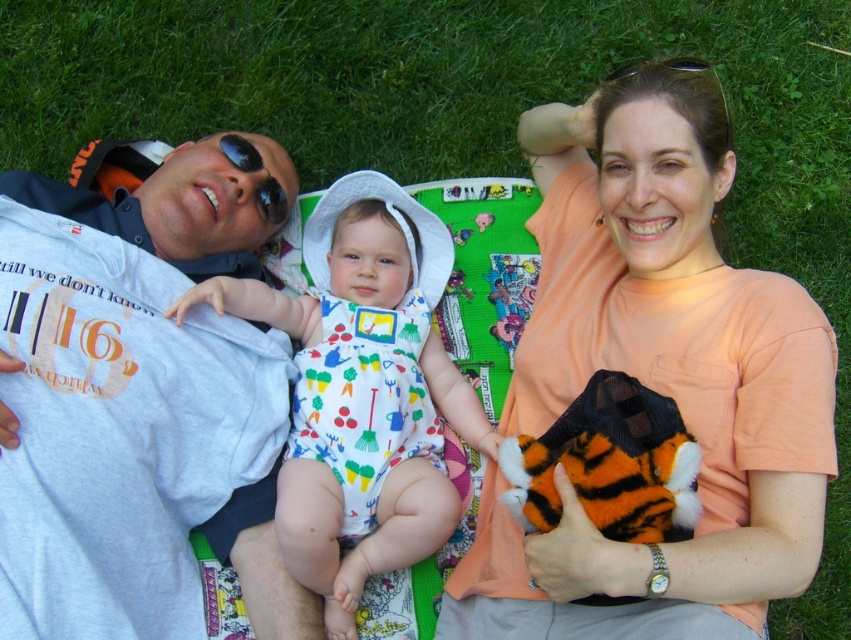
Question: Among these points, which one is nearest to the camera?

Choices:
 (A) (408, 244)
 (B) (603, 272)

Answer: (B)

Question: Which of the following is the closest to the observer?

Choices:
 (A) gray cotton t-shirt at left
 (B) orange cotton shirt at upper right

Answer: (B)

Question: Can you confirm if orange cotton shirt at upper right is wider than printed cotton onesie at center?

Choices:
 (A) yes
 (B) no

Answer: (A)

Question: Which object is closer to the camera taking this photo?

Choices:
 (A) gray cotton t-shirt at left
 (B) printed cotton onesie at center
 (C) orange cotton shirt at upper right

Answer: (C)

Question: Does printed cotton onesie at center have a larger size compared to gray cotton t-shirt at left?

Choices:
 (A) yes
 (B) no

Answer: (A)

Question: Does printed cotton onesie at center appear on the left side of gray cotton t-shirt at left?

Choices:
 (A) yes
 (B) no

Answer: (B)